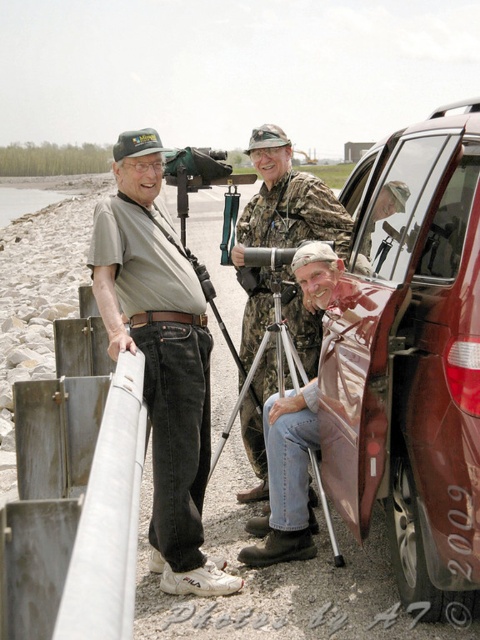
You are standing at the point with coordinates point (294,340) and want to walk to point (280,388). Which direction should you move in relation to the scene?

You should move away from the viewer to reach point (280,388) because it is further away than point (294,340).

You are a photographer trying to set up your equipment. You have a camouflage fabric uniform at center and a silver metallic tripod at center. How far apart are these two items from each other?

The camouflage fabric uniform at center and silver metallic tripod at center are 22.95 centimeters apart.